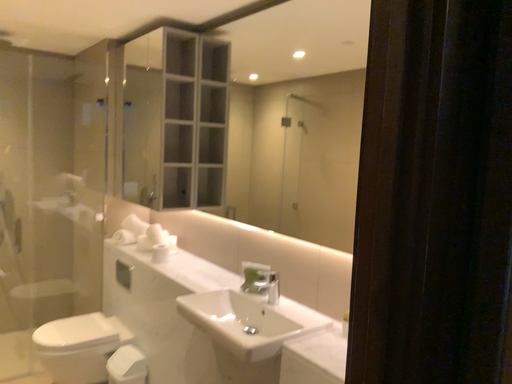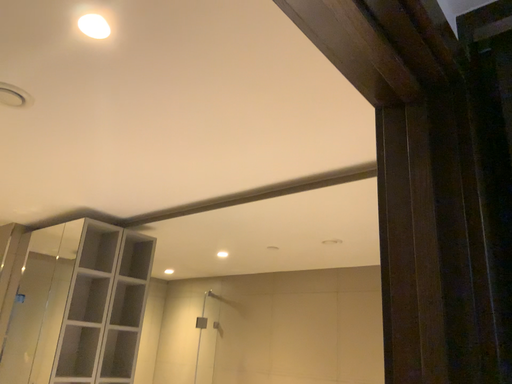
Question: How did the camera likely rotate when shooting the video?

Choices:
 (A) rotated downward
 (B) rotated upward

Answer: (B)